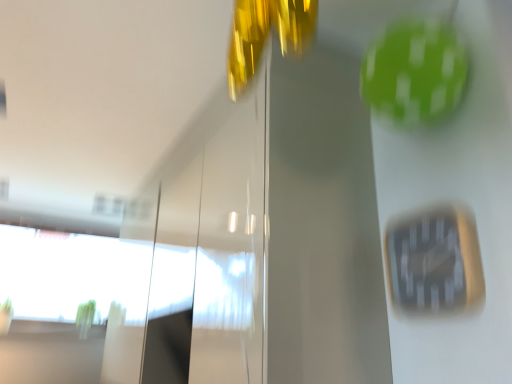
The width and height of the screenshot is (512, 384). Identify the location of free space above transparent glass window at lower left (from a real-world perspective). (69, 223).